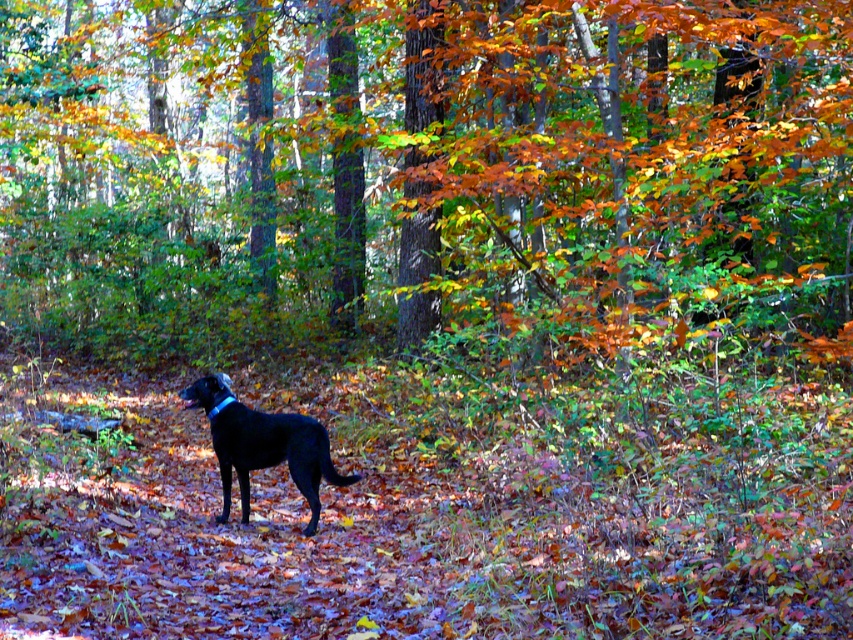
You are a GUI agent. You are given a task and a screenshot of the screen. Output one action in this format:
    pyautogui.click(x=<x>, y=<y>)
    Task: Click on the shiny black dog at center
    The width and height of the screenshot is (853, 640).
    Given the screenshot: What is the action you would take?
    pyautogui.click(x=271, y=454)

Can you confirm if shiny black dog at center is positioned below blue fabric neckband at center?

Correct, shiny black dog at center is located below blue fabric neckband at center.

Describe the element at coordinates (271, 454) in the screenshot. I see `shiny black dog at center` at that location.

At what (x,y) coordinates should I click in order to perform the action: click on shiny black dog at center. Please return your answer as a coordinate pair (x, y). The image size is (853, 640). Looking at the image, I should click on (271, 454).